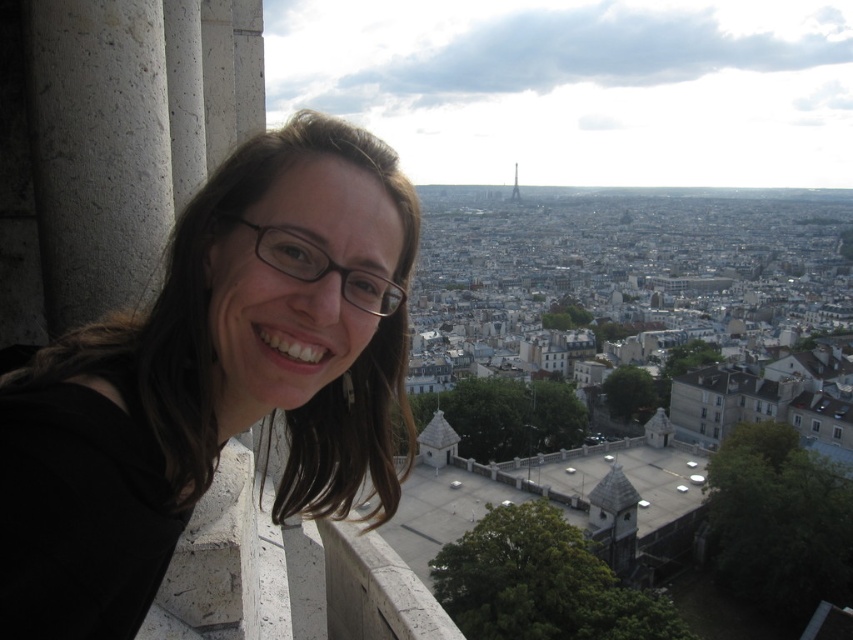
You are a photographer on the balcony and want to capture both the matte black hair at left and the metallic gold eiffel tower at center in the same frame. Given the distance between them, will you need to adjust your camera settings to focus on both subjects simultaneously?

The distance between the matte black hair at left and the metallic gold eiffel tower at center is 1961.38 feet. To capture both in focus, you would need a small aperture setting to increase depth of field, ensuring both near and far subjects are sharp.

You are a photographer trying to capture a clear shot of the metallic gold eiffel tower at center. However, the matte black hair at left is blocking part of the view. Which direction should you move your camera to avoid the obstruction?

To avoid the obstruction caused by the matte black hair at left, you should move your camera to the right side of the metallic gold eiffel tower at center since the hair is on the left side of it.

You are a photographer taking a picture of the matte black hair at left and the metallic gold eiffel tower at center. Which object is closer to the camera lens?

The matte black hair at left is closer to the camera lens because it is positioned under the metallic gold eiffel tower at center, indicating it is in front of the tower in the frame.